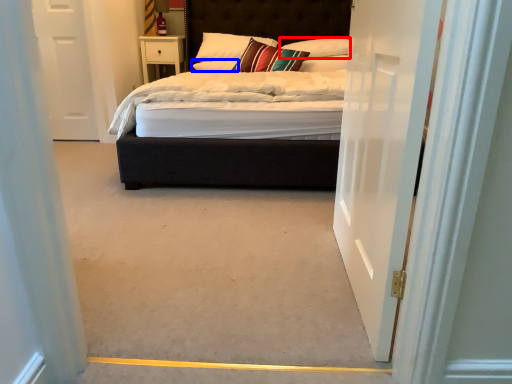
Question: Which object is closer to the camera taking this photo, pillow (highlighted by a red box) or pillow (highlighted by a blue box)?

Choices:
 (A) pillow
 (B) pillow

Answer: (A)